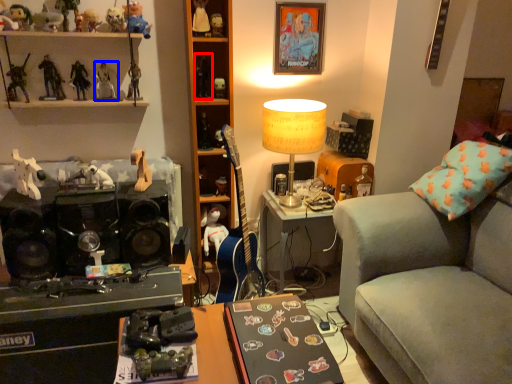
Question: Which of the following is the farthest to the observer, toy (highlighted by a red box) or toy (highlighted by a blue box)?

Choices:
 (A) toy
 (B) toy

Answer: (A)